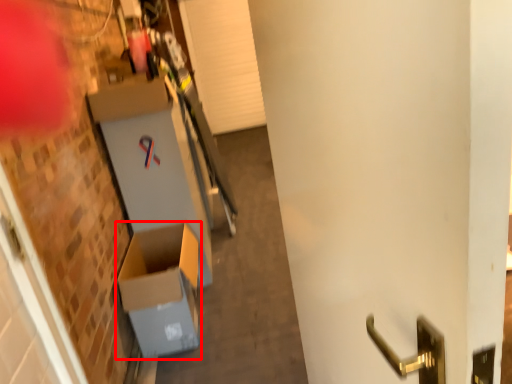
Question: Where is cardboard box (annotated by the red box) located in relation to door in the image?

Choices:
 (A) left
 (B) right

Answer: (A)